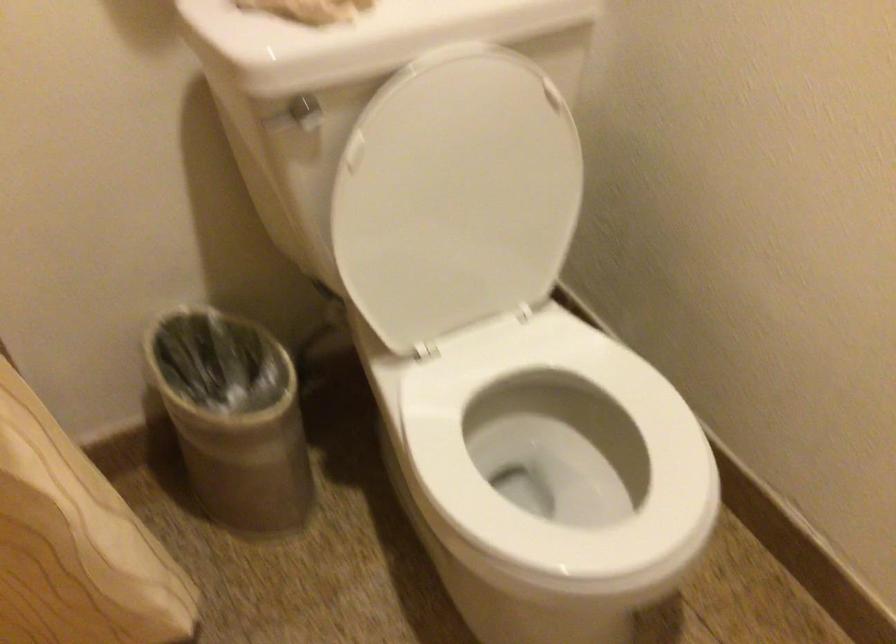
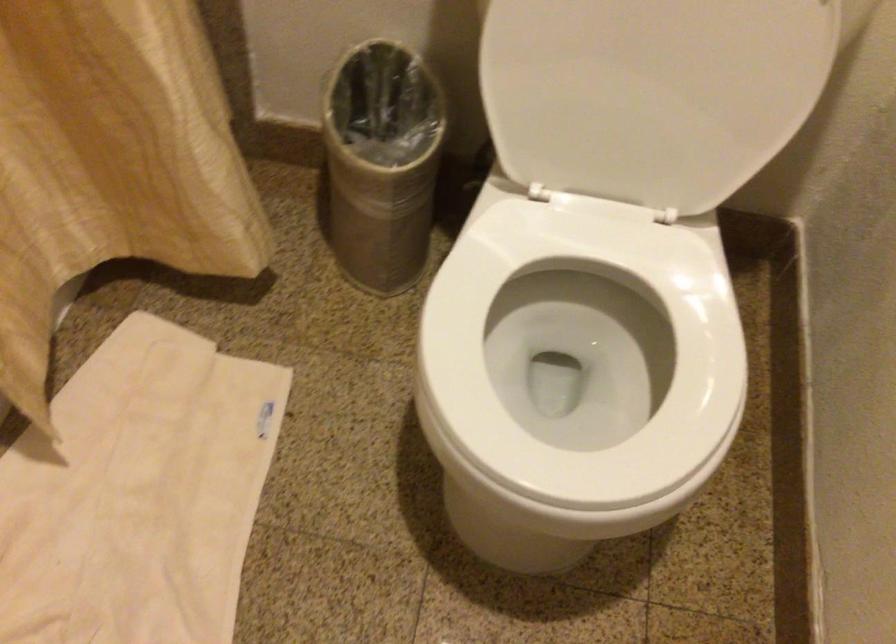
How did the camera likely rotate?

The camera's rotation is toward left-down.